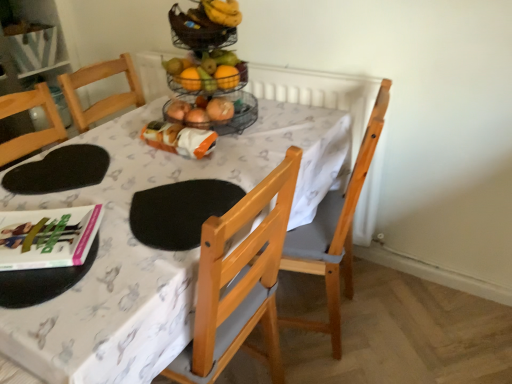
Identify the location of vacant region in front of orange plastic bag at center. This screenshot has width=512, height=384. (162, 169).